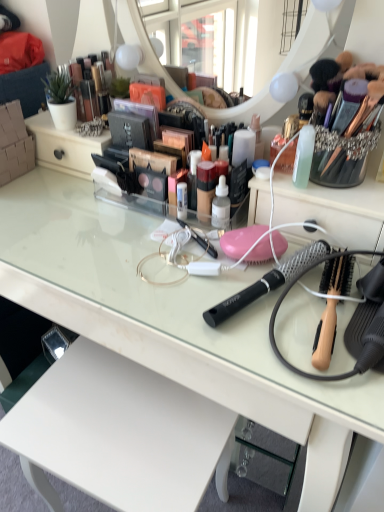
Where is `vacant area that lies between black mesh hairbrush at center, which appears as the second brush when viewed from the right, and wooden-handled hairbrush at right, the 2th brush in the left-to-right sequence`? This screenshot has width=384, height=512. vacant area that lies between black mesh hairbrush at center, which appears as the second brush when viewed from the right, and wooden-handled hairbrush at right, the 2th brush in the left-to-right sequence is located at coordinates (272, 321).